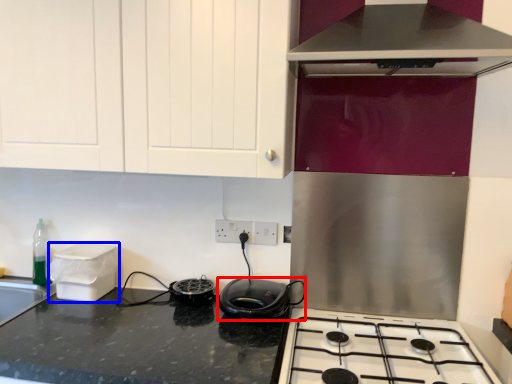
Question: Which point is further to the camera, kitchen appliance (highlighted by a red box) or appliance (highlighted by a blue box)?

Choices:
 (A) kitchen appliance
 (B) appliance

Answer: (B)